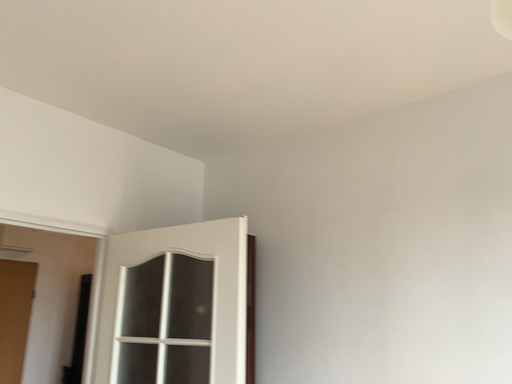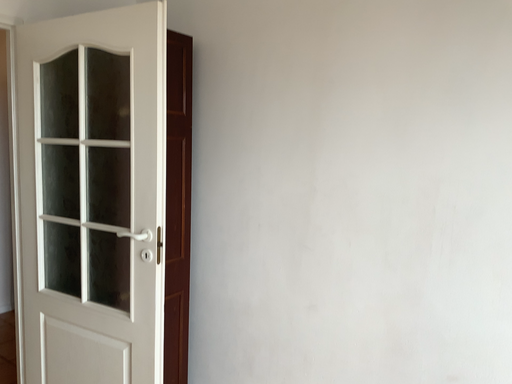
Question: Which way did the camera rotate in the video?

Choices:
 (A) rotated upward
 (B) rotated downward

Answer: (B)